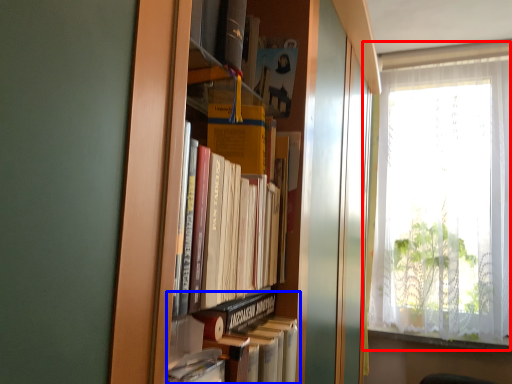
Question: Among these objects, which one is farthest to the camera, window (highlighted by a red box) or book (highlighted by a blue box)?

Choices:
 (A) window
 (B) book

Answer: (A)